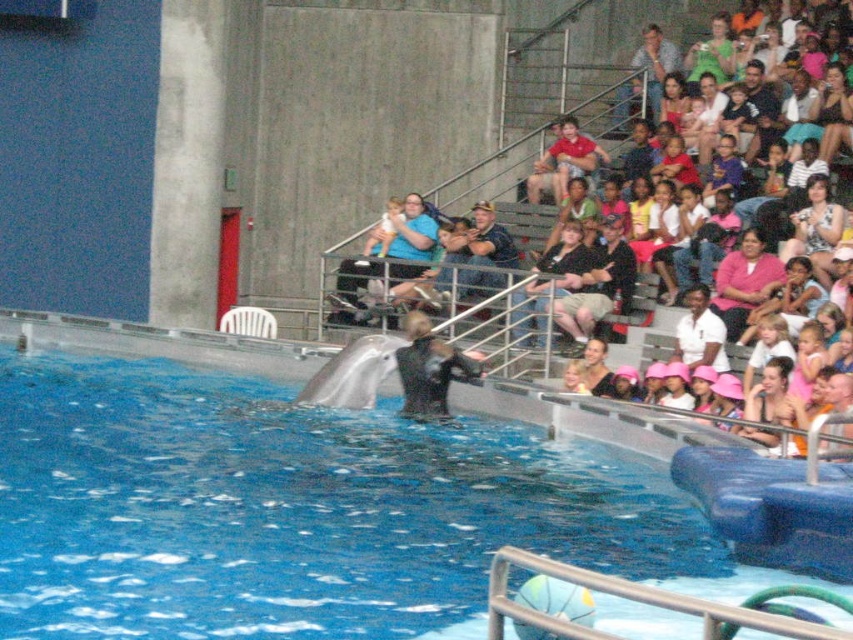
You are a photographer trying to capture a clear shot of the dolphin show. You notice two spectators in the crowd wearing a matte black shirt at center and a white cotton shirt at upper right. Which spectator is blocking your view of the dolphin?

The matte black shirt at center is blocking your view because the white cotton shirt at upper right is behind it, meaning the matte black shirt is closer to the front.

Consider the image. You are a photographer at the dolphin show and you want to capture both the matte black shirt at center and the white cotton shirt at upper right in the same frame. Which shirt should you focus on first to ensure both are in the frame?

The matte black shirt at center is located above the white cotton shirt at upper right, so focusing on the matte black shirt at center first will allow you to adjust the camera angle downward to include the white cotton shirt at upper right in the frame.

You are a photographer in the audience at the dolphin show. You want to capture a photo of the matte black dolphin at center without the blue rubber swimming pool at center appearing in the frame. Is this possible based on their positions?

The blue rubber swimming pool at center is to the left of the matte black dolphin at center, so if you position yourself to the right side of the dolphin, you can frame the shot to exclude the pool.